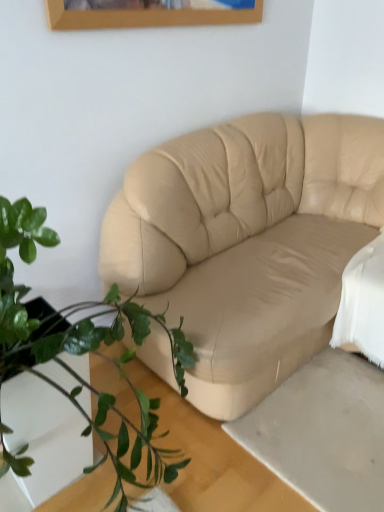
Question: From the image's perspective, is beige leather couch at center located above green leafy plant at lower left?

Choices:
 (A) yes
 (B) no

Answer: (A)

Question: Is green leafy plant at lower left a part of beige leather couch at center?

Choices:
 (A) yes
 (B) no

Answer: (B)

Question: Would you say beige leather couch at center is outside green leafy plant at lower left?

Choices:
 (A) yes
 (B) no

Answer: (A)

Question: From a real-world perspective, is beige leather couch at center over green leafy plant at lower left?

Choices:
 (A) no
 (B) yes

Answer: (A)

Question: Is beige leather couch at center facing towards green leafy plant at lower left?

Choices:
 (A) yes
 (B) no

Answer: (A)

Question: Is beige leather couch at center at the left side of green leafy plant at lower left?

Choices:
 (A) no
 (B) yes

Answer: (A)

Question: Is beige leather couch at center at the back of green leafy plant at lower left?

Choices:
 (A) no
 (B) yes

Answer: (A)

Question: Can you confirm if green leafy plant at lower left is wider than beige leather couch at center?

Choices:
 (A) yes
 (B) no

Answer: (B)

Question: Considering the relative sizes of green leafy plant at lower left and beige leather couch at center in the image provided, is green leafy plant at lower left smaller than beige leather couch at center?

Choices:
 (A) yes
 (B) no

Answer: (A)

Question: Does green leafy plant at lower left turn towards beige leather couch at center?

Choices:
 (A) yes
 (B) no

Answer: (B)

Question: From a real-world perspective, is green leafy plant at lower left physically above beige leather couch at center?

Choices:
 (A) yes
 (B) no

Answer: (A)

Question: Does green leafy plant at lower left come in front of beige leather couch at center?

Choices:
 (A) yes
 (B) no

Answer: (A)

Question: Is green leafy plant at lower left wider or thinner than beige leather couch at center?

Choices:
 (A) wide
 (B) thin

Answer: (B)